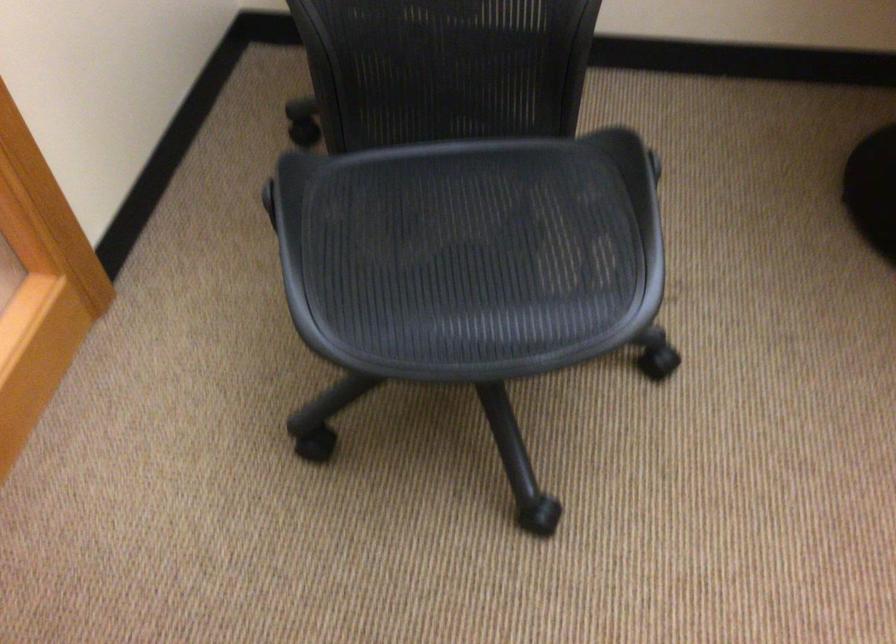
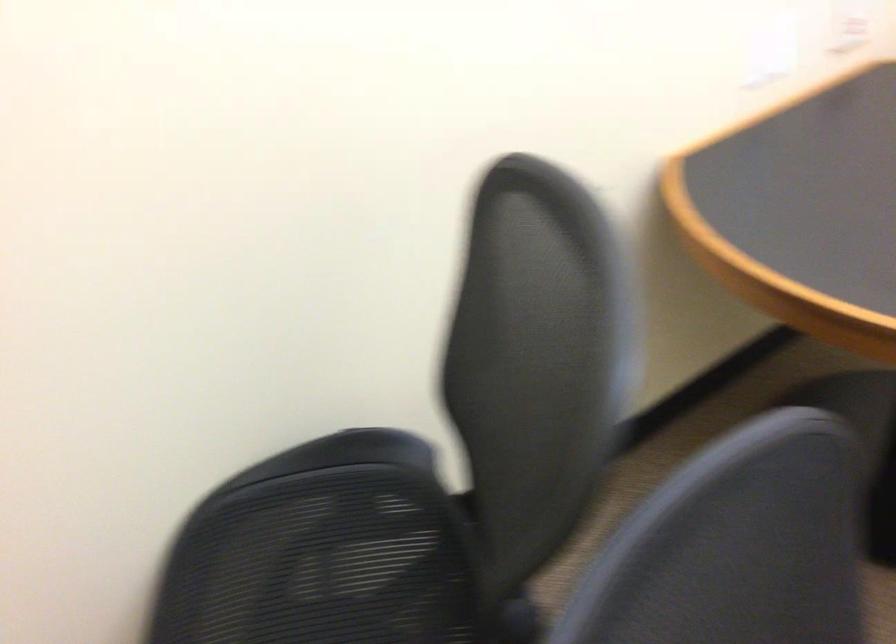
Question: The camera is either moving clockwise (left) or counter-clockwise (right) around the object. The first image is from the beginning of the video and the second image is from the end. Is the camera moving left or right when shooting the video?

Choices:
 (A) Left
 (B) Right

Answer: (A)